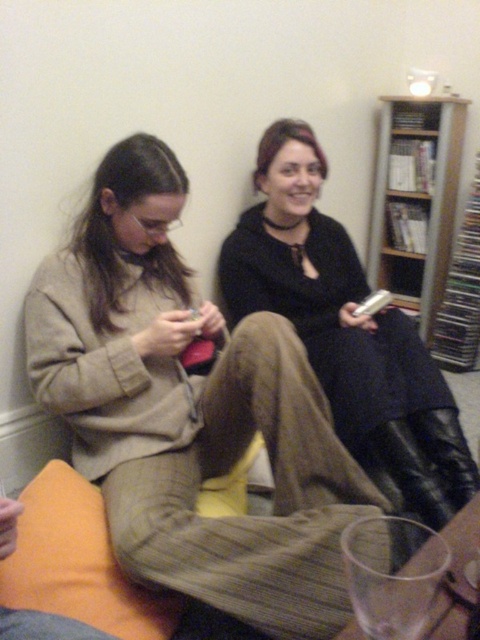
Does wooden bookshelf at upper right appear on the left side of matte black phone at center?

In fact, wooden bookshelf at upper right is to the right of matte black phone at center.

Who is lower down, wooden bookshelf at upper right or matte black phone at center?

Positioned lower is matte black phone at center.

Is point (410, 291) behind point (373, 292)?

Yes.

This screenshot has width=480, height=640. What are the coordinates of `wooden bookshelf at upper right` in the screenshot? It's located at (416, 198).

Is orange fabric pillow at lower left below matte black phone at center?

Indeed, orange fabric pillow at lower left is positioned under matte black phone at center.

You are a GUI agent. You are given a task and a screenshot of the screen. Output one action in this format:
    pyautogui.click(x=<x>, y=<y>)
    Task: Click on the orange fabric pillow at lower left
    This screenshot has height=640, width=480.
    Given the screenshot: What is the action you would take?
    pyautogui.click(x=78, y=563)

At what (x,y) coordinates should I click in order to perform the action: click on orange fabric pillow at lower left. Please return your answer as a coordinate pair (x, y). The image size is (480, 640). Looking at the image, I should click on (78, 563).

Does beige woolen sweater at center have a smaller size compared to wooden bookshelf at upper right?

Actually, beige woolen sweater at center might be larger than wooden bookshelf at upper right.

Does point (85, 419) come farther from viewer compared to point (373, 177)?

No, (85, 419) is in front of (373, 177).

Between point (192, 400) and point (432, 240), which one is positioned behind?

Point (432, 240)

Locate an element on the screen. This screenshot has height=640, width=480. beige woolen sweater at center is located at coordinates (189, 412).